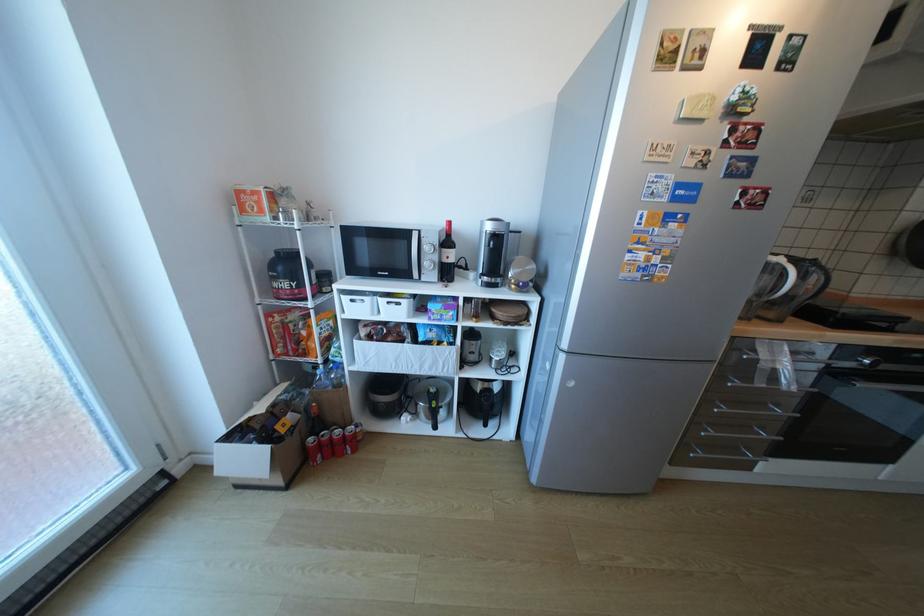
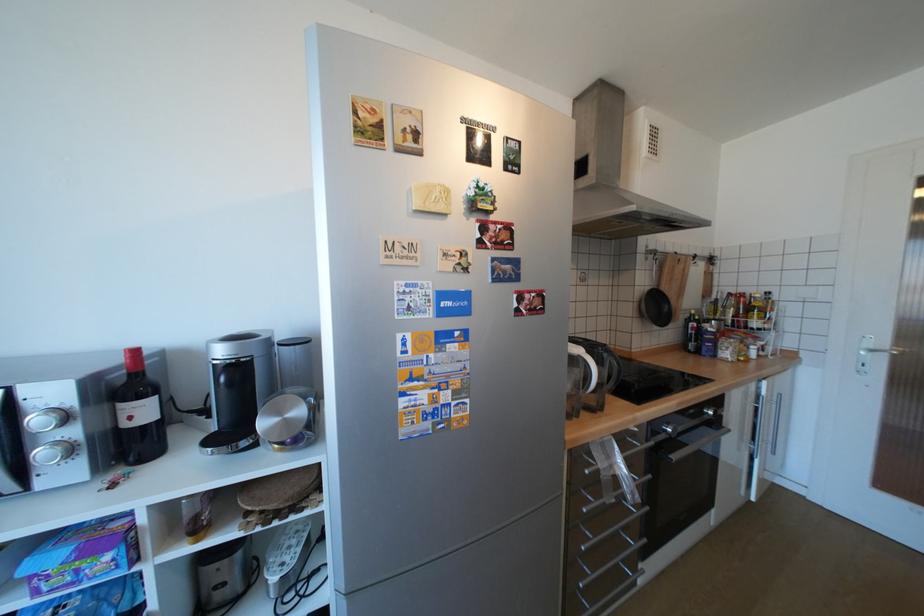
Locate, in the second image, the point that corresponds to (x=434, y=248) in the first image.

(46, 419)